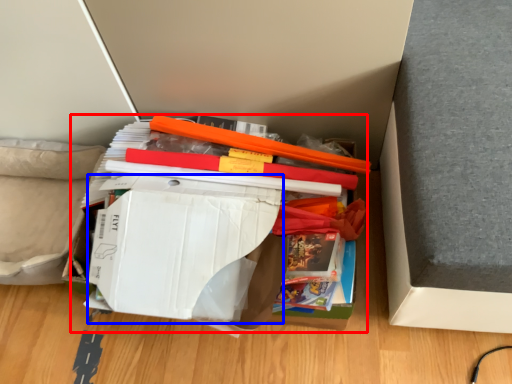
Question: Which point is further to the camera, paperback book (highlighted by a red box) or paperback book (highlighted by a blue box)?

Choices:
 (A) paperback book
 (B) paperback book

Answer: (A)